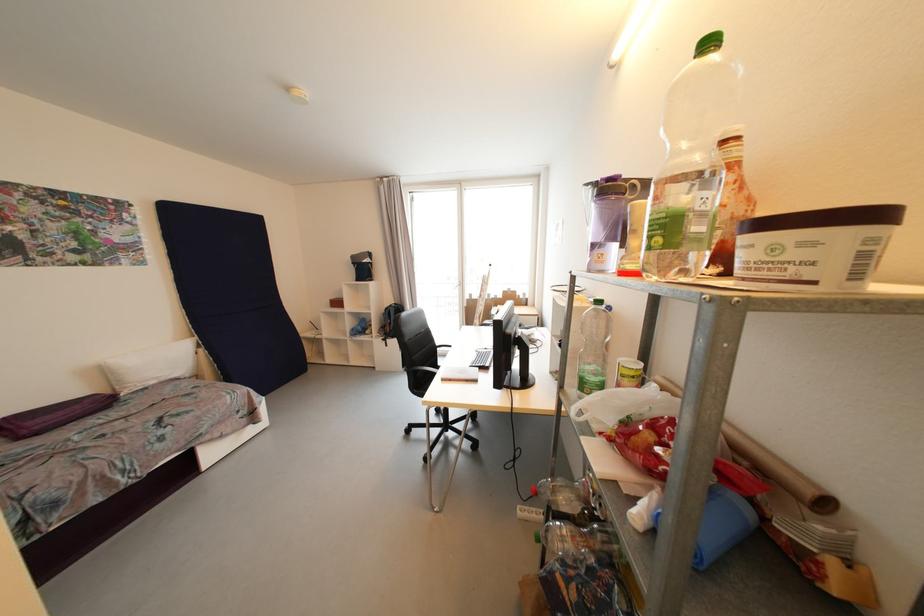
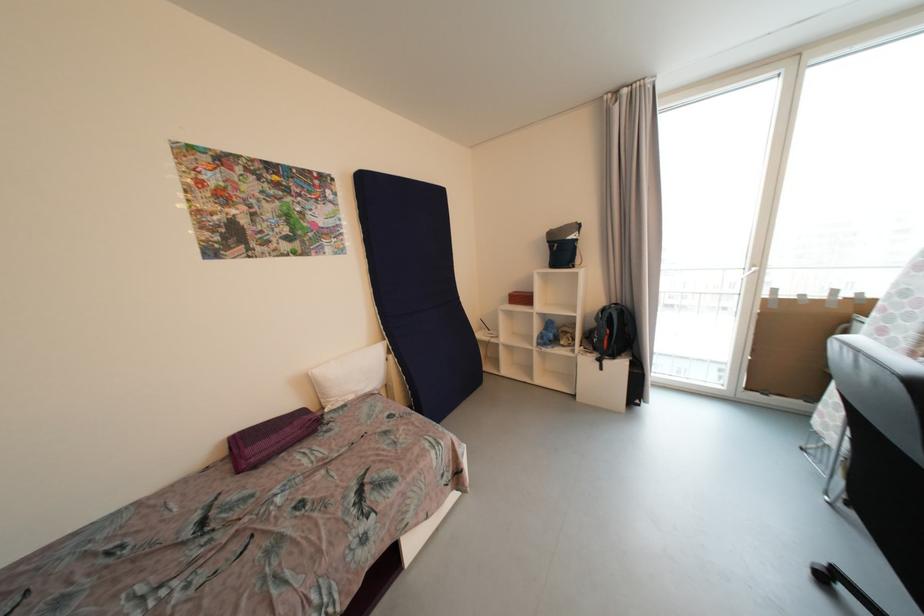
The point at (207,352) is marked in the first image. Where is the corresponding point in the second image?

(396, 359)